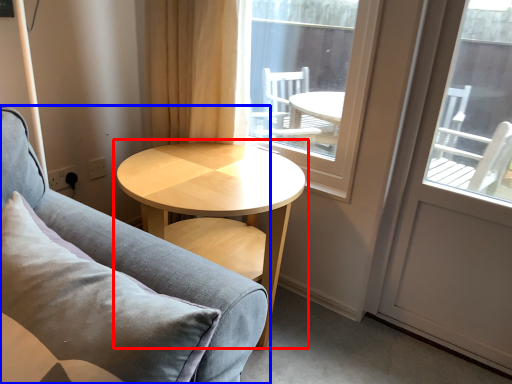
Question: Which point is closer to the camera, coffee table (highlighted by a red box) or studio couch (highlighted by a blue box)?

Choices:
 (A) coffee table
 (B) studio couch

Answer: (B)